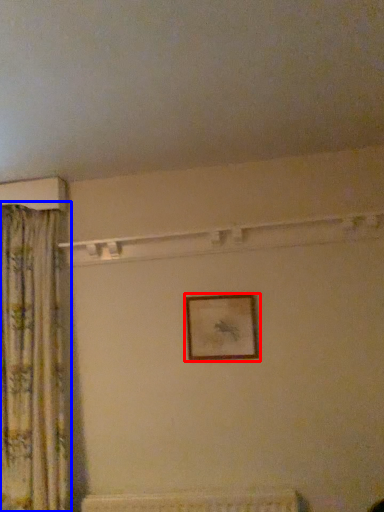
Question: Which point is closer to the camera, picture frame (highlighted by a red box) or curtain (highlighted by a blue box)?

Choices:
 (A) picture frame
 (B) curtain

Answer: (B)